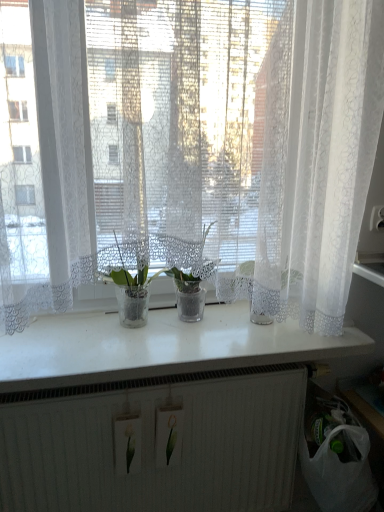
At what (x,y) coordinates should I click in order to perform the action: click on white lace curtain at center. Please return your answer as a coordinate pair (x, y). Looking at the image, I should click on (196, 151).

What do you see at coordinates (131, 292) in the screenshot? Image resolution: width=384 pixels, height=512 pixels. I see `clear glass vase at center, acting as the second houseplant starting from the right` at bounding box center [131, 292].

At what (x,y) coordinates should I click in order to perform the action: click on translucent glass pot at center, marked as the second houseplant in a left-to-right arrangement. Please return your answer as a coordinate pair (x, y). Image resolution: width=384 pixels, height=512 pixels. Looking at the image, I should click on (188, 273).

Where is `white lace curtain at center`? Image resolution: width=384 pixels, height=512 pixels. white lace curtain at center is located at coordinates (196, 151).

Looking at this image, considering the relative sizes of white glossy counter top at center and white ribbed radiator at lower center in the image provided, is white glossy counter top at center taller than white ribbed radiator at lower center?

Incorrect, the height of white glossy counter top at center is not larger of that of white ribbed radiator at lower center.

Is the surface of white glossy counter top at center in direct contact with white ribbed radiator at lower center?

No, white glossy counter top at center is not with white ribbed radiator at lower center.

From a real-world perspective, which is physically below, white glossy counter top at center or white ribbed radiator at lower center?

white ribbed radiator at lower center.

Which is more to the right, white glossy counter top at center or white ribbed radiator at lower center?

Positioned to the right is white glossy counter top at center.

Consider the image. Would you say white glossy counter top at center is to the left or to the right of white lace curtain at center in the picture?

From the image, it's evident that white glossy counter top at center is to the left of white lace curtain at center.

Considering the sizes of objects white glossy counter top at center and white lace curtain at center in the image provided, who is smaller, white glossy counter top at center or white lace curtain at center?

white glossy counter top at center is smaller.

Does point (138, 355) come in front of point (304, 221)?

Yes, it is in front of point (304, 221).

Where is `counter top behind the white lace curtain at center`? counter top behind the white lace curtain at center is located at coordinates (157, 347).

From the image's perspective, would you say white lace curtain at center is shown under white ribbed radiator at lower center?

No, from the image's perspective, white lace curtain at center is not beneath white ribbed radiator at lower center.

Would you consider white lace curtain at center to be distant from white ribbed radiator at lower center?

white lace curtain at center is near white ribbed radiator at lower center, not far away.

Based on the photo, how different are the orientations of white lace curtain at center and white ribbed radiator at lower center in degrees?

The angular difference between white lace curtain at center and white ribbed radiator at lower center is 0.483 degrees.

From a real-world perspective, is white lace curtain at center physically below white ribbed radiator at lower center?

Incorrect, from a real-world perspective, white lace curtain at center is higher than white ribbed radiator at lower center.

Does white ribbed radiator at lower center have a lesser height compared to clear glass vase at center, the 1th houseplant when ordered from left to right?

In fact, white ribbed radiator at lower center may be taller than clear glass vase at center, the 1th houseplant when ordered from left to right.

Considering the sizes of objects white ribbed radiator at lower center and clear glass vase at center, acting as the second houseplant starting from the right, in the image provided, who is smaller, white ribbed radiator at lower center or clear glass vase at center, acting as the second houseplant starting from the right,?

With smaller size is clear glass vase at center, acting as the second houseplant starting from the right.

Considering the relative sizes of white ribbed radiator at lower center and clear glass vase at center, the 1th houseplant when ordered from left to right, in the image provided, is white ribbed radiator at lower center thinner than clear glass vase at center, the 1th houseplant when ordered from left to right,?

Yes.

You are a GUI agent. You are given a task and a screenshot of the screen. Output one action in this format:
    pyautogui.click(x=<x>, y=<y>)
    Task: Click on the 1st houseplant positioned above the white ribbed radiator at lower center (from the image's perspective)
    The width and height of the screenshot is (384, 512).
    Given the screenshot: What is the action you would take?
    pyautogui.click(x=131, y=292)

How distant is clear glass vase at center, the 1th houseplant when ordered from left to right, from white lace curtain at center?

The distance of clear glass vase at center, the 1th houseplant when ordered from left to right, from white lace curtain at center is 39.61 centimeters.

From a real-world perspective, which houseplant is the 2nd one underneath the white lace curtain at center? Please provide its 2D coordinates.

[(131, 292)]

Is clear glass vase at center, acting as the second houseplant starting from the right, aimed at white lace curtain at center?

Yes, clear glass vase at center, acting as the second houseplant starting from the right, faces towards white lace curtain at center.

Which object is wider, clear glass vase at center, acting as the second houseplant starting from the right, or white lace curtain at center?

With larger width is white lace curtain at center.

Is point (360, 11) farther from viewer compared to point (142, 303)?

No, it is not.

Between white lace curtain at center and clear glass vase at center, the 1th houseplant when ordered from left to right, which one is positioned behind?

clear glass vase at center, the 1th houseplant when ordered from left to right, is further from the camera.

Can we say white lace curtain at center lies outside clear glass vase at center, the 1th houseplant when ordered from left to right?

Yes, white lace curtain at center is located beyond the bounds of clear glass vase at center, the 1th houseplant when ordered from left to right.

In terms of size, does white lace curtain at center appear bigger or smaller than clear glass vase at center, the 1th houseplant when ordered from left to right?

In the image, white lace curtain at center appears to be larger than clear glass vase at center, the 1th houseplant when ordered from left to right.

Is white glossy counter top at center facing towards translucent glass pot at center, marked as the second houseplant in a left-to-right arrangement?

No, white glossy counter top at center is not facing towards translucent glass pot at center, marked as the second houseplant in a left-to-right arrangement.

Which object is wider, white glossy counter top at center or translucent glass pot at center, the first houseplant from the right?

white glossy counter top at center.

Who is bigger, white glossy counter top at center or translucent glass pot at center, the first houseplant from the right?

white glossy counter top at center is bigger.

Would you consider white glossy counter top at center to be distant from translucent glass pot at center, marked as the second houseplant in a left-to-right arrangement?

Actually, white glossy counter top at center and translucent glass pot at center, marked as the second houseplant in a left-to-right arrangement, are a little close together.

You are a GUI agent. You are given a task and a screenshot of the screen. Output one action in this format:
    pyautogui.click(x=<x>, y=<y>)
    Task: Click on the counter top lying above the white ribbed radiator at lower center (from the image's perspective)
    Image resolution: width=384 pixels, height=512 pixels.
    Given the screenshot: What is the action you would take?
    pyautogui.click(x=157, y=347)

Where is `counter top located underneath the white lace curtain at center (from a real-world perspective)`? counter top located underneath the white lace curtain at center (from a real-world perspective) is located at coordinates (157, 347).

Considering their positions, is clear glass vase at center, acting as the second houseplant starting from the right, positioned further to translucent glass pot at center, the first houseplant from the right, than white ribbed radiator at lower center?

The object further to translucent glass pot at center, the first houseplant from the right, is white ribbed radiator at lower center.

Looking at the image, which one is located closer to white ribbed radiator at lower center, white lace curtain at center or translucent glass pot at center, marked as the second houseplant in a left-to-right arrangement?

translucent glass pot at center, marked as the second houseplant in a left-to-right arrangement.

Based on their spatial positions, is white glossy counter top at center or translucent glass pot at center, the first houseplant from the right, closer to clear glass vase at center, the 1th houseplant when ordered from left to right?

translucent glass pot at center, the first houseplant from the right, is closer to clear glass vase at center, the 1th houseplant when ordered from left to right.

When comparing their distances from white lace curtain at center, does white ribbed radiator at lower center or clear glass vase at center, the 1th houseplant when ordered from left to right, seem further?

white ribbed radiator at lower center lies further to white lace curtain at center than the other object.

Considering their positions, is translucent glass pot at center, the first houseplant from the right, positioned closer to white lace curtain at center than clear glass vase at center, the 1th houseplant when ordered from left to right?

translucent glass pot at center, the first houseplant from the right, is positioned closer to the anchor white lace curtain at center.

When comparing their distances from white ribbed radiator at lower center, does white lace curtain at center or white glossy counter top at center seem closer?

white glossy counter top at center.

Considering their positions, is white ribbed radiator at lower center positioned closer to white glossy counter top at center than translucent glass pot at center, marked as the second houseplant in a left-to-right arrangement?

Among the two, white ribbed radiator at lower center is located nearer to white glossy counter top at center.

Looking at the image, which one is located further to white ribbed radiator at lower center, white glossy counter top at center or clear glass vase at center, the 1th houseplant when ordered from left to right?

Among the two, clear glass vase at center, the 1th houseplant when ordered from left to right, is located further to white ribbed radiator at lower center.

The height and width of the screenshot is (512, 384). I want to click on counter top between translucent glass pot at center, the first houseplant from the right, and white ribbed radiator at lower center in the up-down direction, so click(157, 347).

You are a GUI agent. You are given a task and a screenshot of the screen. Output one action in this format:
    pyautogui.click(x=<x>, y=<y>)
    Task: Click on the counter top between white lace curtain at center and white ribbed radiator at lower center vertically
    The width and height of the screenshot is (384, 512).
    Given the screenshot: What is the action you would take?
    pyautogui.click(x=157, y=347)

Locate an element on the screen. houseplant between translucent glass pot at center, marked as the second houseplant in a left-to-right arrangement, and white ribbed radiator at lower center from top to bottom is located at coordinates (131, 292).

Find the location of a particular element. houseplant between white lace curtain at center and translucent glass pot at center, the first houseplant from the right, from front to back is located at coordinates (131, 292).